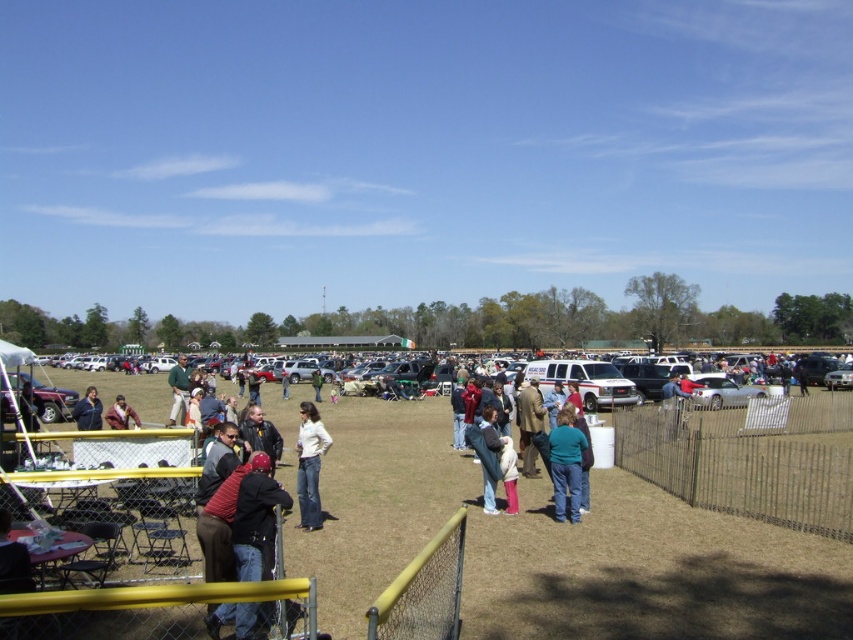
Consider the image. Can you confirm if teal fabric shirt at center is positioned above green fabric shirt at center?

Yes.

Can you confirm if teal fabric shirt at center is shorter than green fabric shirt at center?

Correct, teal fabric shirt at center is not as tall as green fabric shirt at center.

Between point (561, 413) and point (173, 406), which one is positioned in front?

Point (561, 413) is in front.

Where is `teal fabric shirt at center`? This screenshot has width=853, height=640. teal fabric shirt at center is located at coordinates (566, 467).

Between white matte shirt at center and green fabric shirt at center, which one has less height?

white matte shirt at center

The image size is (853, 640). Identify the location of white matte shirt at center. (309, 465).

Can you confirm if dark blue jeans at center is smaller than green fabric shirt at center?

Indeed, dark blue jeans at center has a smaller size compared to green fabric shirt at center.

Can you confirm if dark blue jeans at center is bigger than green fabric shirt at center?

No.

Locate an element on the screen. This screenshot has width=853, height=640. dark blue jeans at center is located at coordinates (254, 516).

The height and width of the screenshot is (640, 853). I want to click on dark blue jeans at center, so click(x=254, y=516).